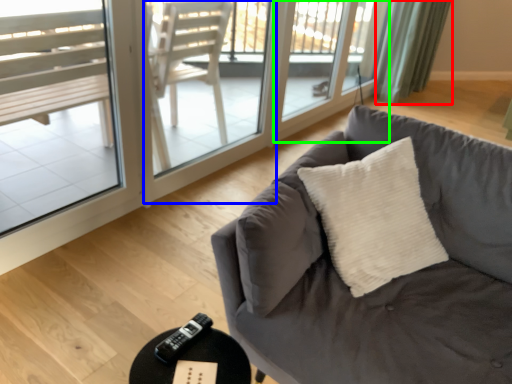
Question: Which object is the farthest from curtain (highlighted by a red box)? Choose among these: screen door (highlighted by a blue box) or screen door (highlighted by a green box).

Choices:
 (A) screen door
 (B) screen door

Answer: (A)